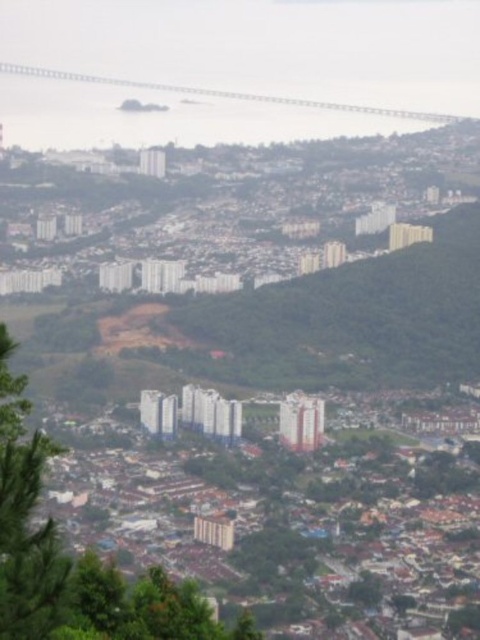
Question: Which point is closer to the camera?

Choices:
 (A) green leafy tree at lower left
 (B) metallic gray bridge at upper left

Answer: (A)

Question: Is the position of green leafy tree at lower left more distant than that of metallic gray bridge at upper left?

Choices:
 (A) yes
 (B) no

Answer: (B)

Question: Can you confirm if green leafy tree at lower left is positioned to the right of metallic gray bridge at upper left?

Choices:
 (A) no
 (B) yes

Answer: (A)

Question: Which of the following is the farthest from the observer?

Choices:
 (A) green leafy tree at lower left
 (B) metallic gray bridge at upper left

Answer: (B)

Question: Does green leafy tree at lower left appear over metallic gray bridge at upper left?

Choices:
 (A) yes
 (B) no

Answer: (B)